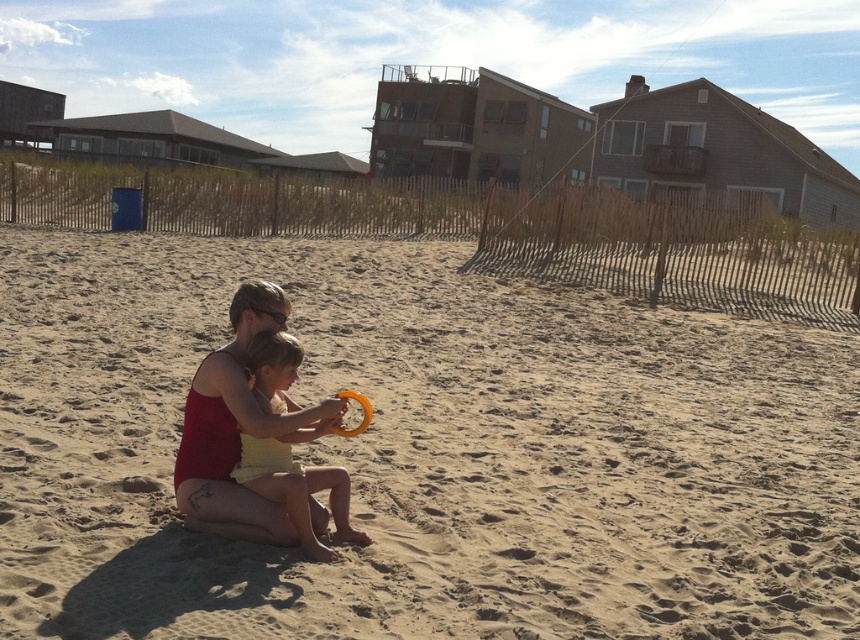
You are a beachgoer who wants to place a small beach umbrella between the yellow fabric at center and the orange rubber ring at center. Which object should you place the umbrella closer to if you want it to be near the smaller object?

The orange rubber ring at center is smaller than the yellow fabric at center, so you should place the umbrella closer to the orange rubber ring at center to be near the smaller object.